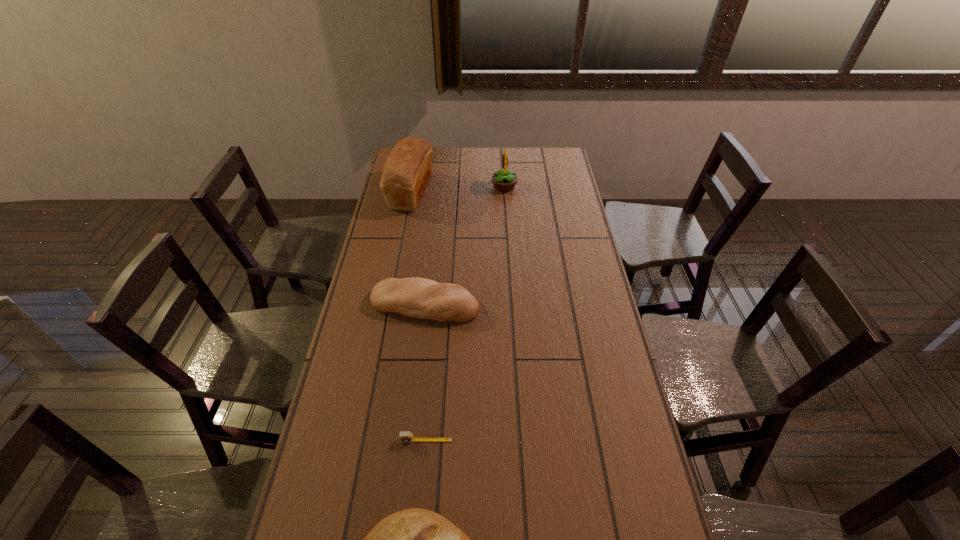
At what (x,y) coordinates should I click in order to perform the action: click on the farthest bread. Please return your answer as a coordinate pair (x, y). The width and height of the screenshot is (960, 540). Looking at the image, I should click on (408, 167).

Where is `the rightmost object`? the rightmost object is located at coordinates (503, 180).

Identify the location of sunflower. (503, 180).

Identify the location of the second farthest bread. [x=415, y=297].

Identify the location of the shortest object. The width and height of the screenshot is (960, 540). (404, 436).

Where is `the fourth farthest object`? the fourth farthest object is located at coordinates (404, 436).

Image resolution: width=960 pixels, height=540 pixels. I want to click on vacant space positioned 0.230m on the right of the tallest bread, so click(x=483, y=192).

Where is `free point located 0.160m on the face of the sunflower`? The image size is (960, 540). free point located 0.160m on the face of the sunflower is located at coordinates (457, 186).

At what (x,y) coordinates should I click in order to perform the action: click on vacant space located 0.070m on the face of the sunflower. Please return your answer as a coordinate pair (x, y). Looking at the image, I should click on (476, 186).

Where is `vacant space situated 0.180m on the face of the sunflower`? vacant space situated 0.180m on the face of the sunflower is located at coordinates (452, 186).